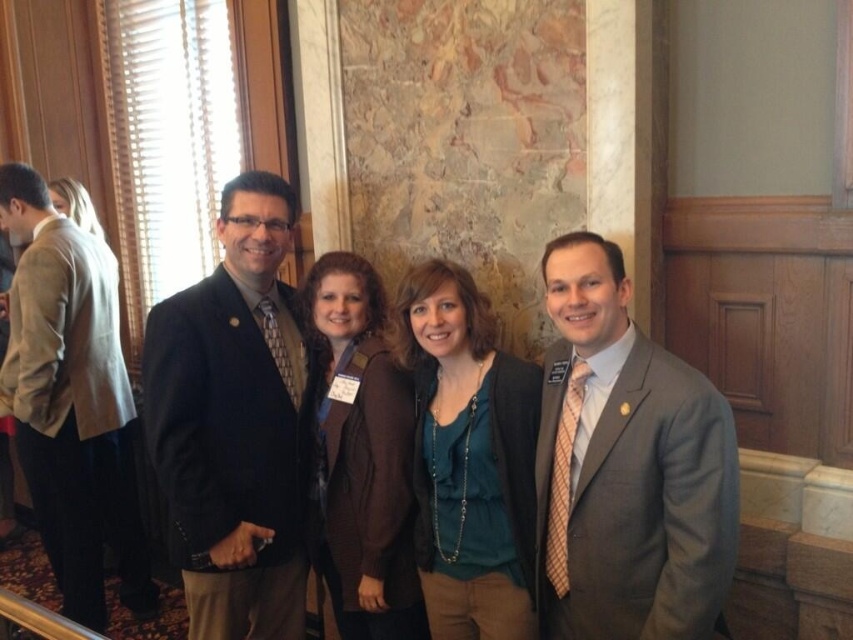
You are a photographer trying to adjust the spacing between the light beige suit at left and the teal jersey at center for a group photo. The current distance between them is 5.44 feet. If the ideal spacing for a professional group photo is between 4 to 5 feet, do you need to ask them to move closer together?

Yes, the light beige suit at left and teal jersey at center are currently 5.44 feet apart, which exceeds the ideal spacing of 4 to 5 feet. They should move closer together to achieve the desired professional look.

In the scene shown: You are standing in front of a group photo of four people. The light beige suit at left is represented by point [71,401]. Can you determine the position of the light beige suit at left relative to the other three individuals in the group?

The light beige suit at left is represented by point [71,401], which is the leftmost position in the group photo.